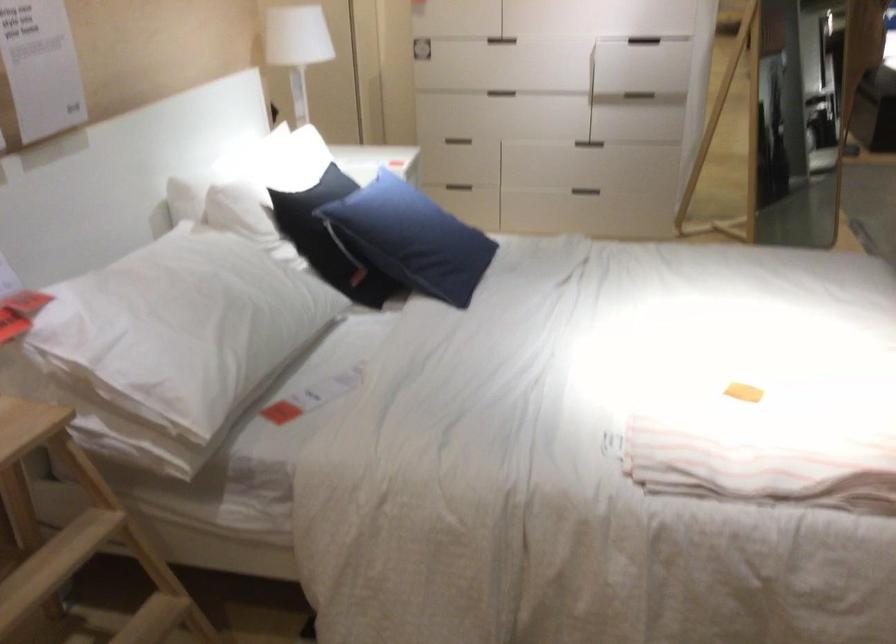
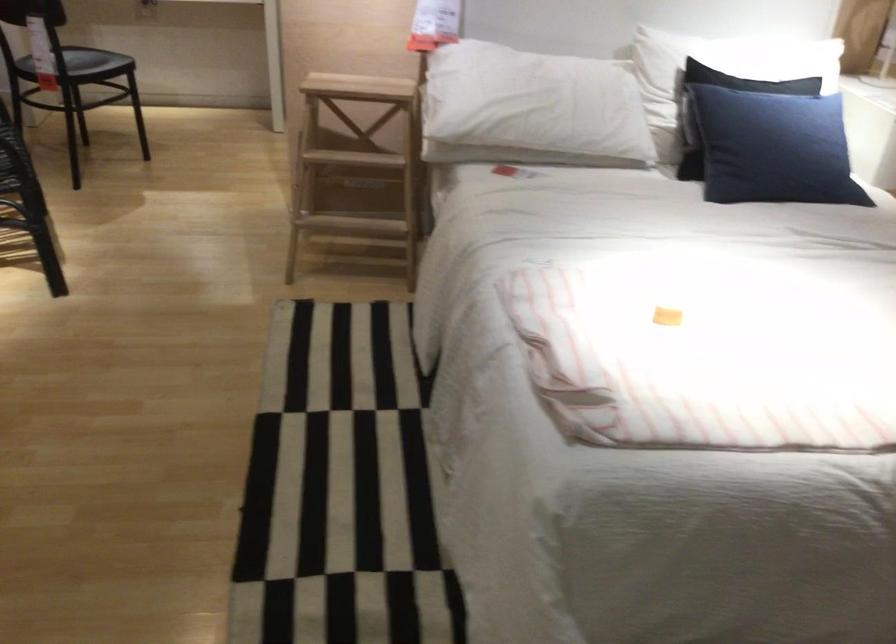
Locate, in the second image, the point that corresponds to point 231,333 in the first image.

(531, 108)